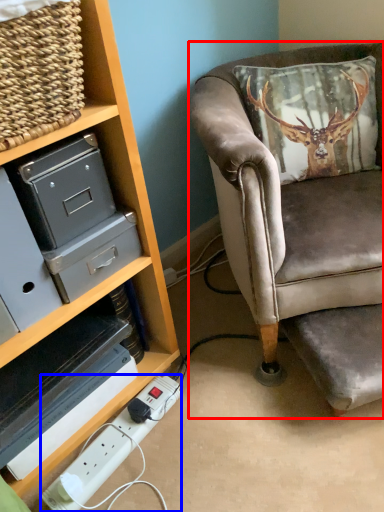
Question: Which object is closer to the camera taking this photo, chair (highlighted by a red box) or extension cord (highlighted by a blue box)?

Choices:
 (A) chair
 (B) extension cord

Answer: (A)